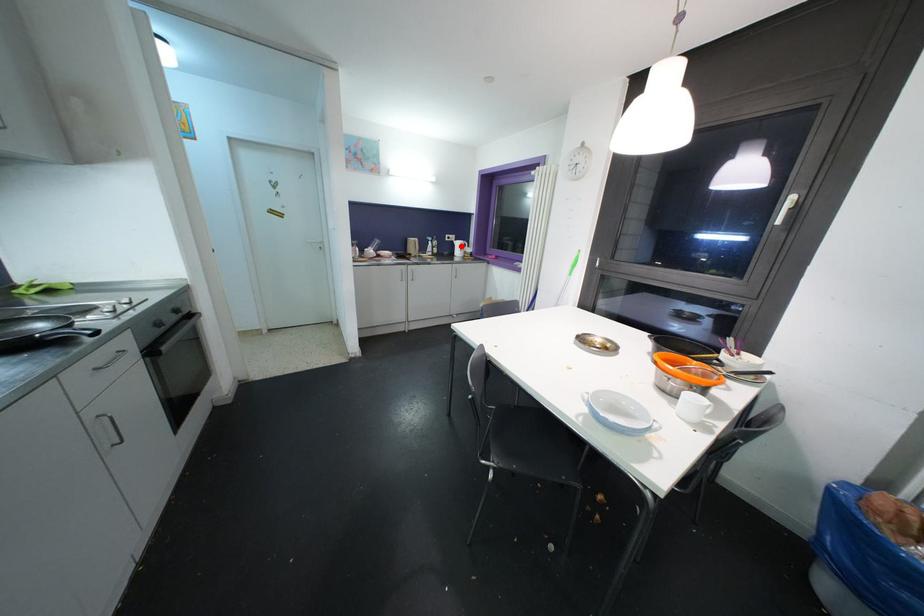
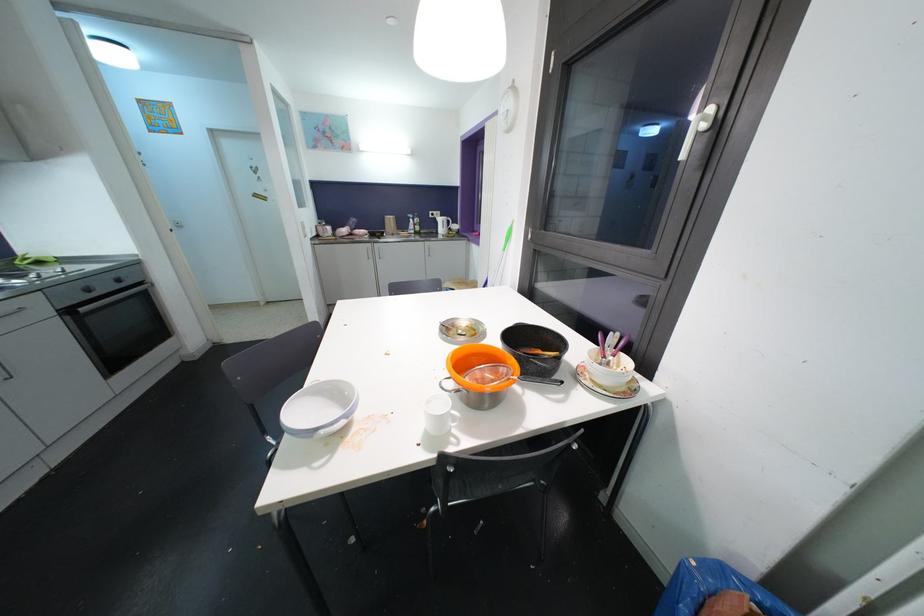
The point at the highlighted location is marked in the first image. Where is the corresponding point in the second image?

(444, 223)